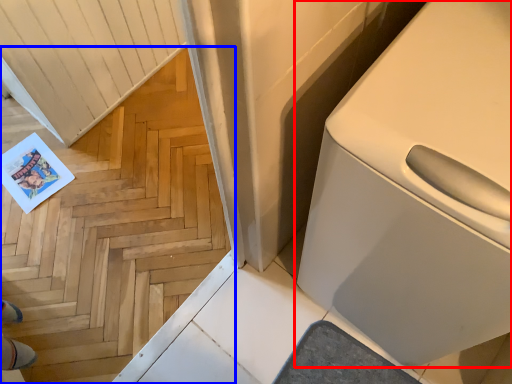
Question: Which of the following is the farthest to the observer, home appliance (highlighted by a red box) or stairwell (highlighted by a blue box)?

Choices:
 (A) home appliance
 (B) stairwell

Answer: (A)